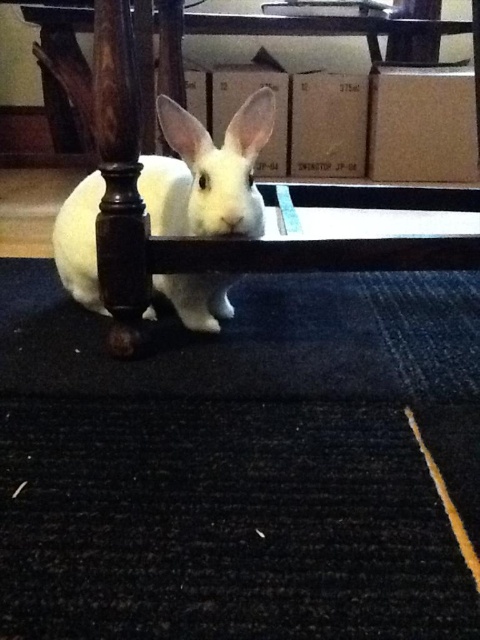
Question: Can you confirm if black textured mat at lower center is wider than white soft fur rabbit at center?

Choices:
 (A) no
 (B) yes

Answer: (B)

Question: Does black textured mat at lower center appear on the left side of white soft fur rabbit at center?

Choices:
 (A) no
 (B) yes

Answer: (A)

Question: Does black textured mat at lower center have a smaller size compared to white soft fur rabbit at center?

Choices:
 (A) yes
 (B) no

Answer: (B)

Question: Which object is farther from the camera taking this photo?

Choices:
 (A) black textured mat at lower center
 (B) white soft fur rabbit at center

Answer: (B)

Question: Which point is closer to the camera?

Choices:
 (A) black textured mat at lower center
 (B) white soft fur rabbit at center

Answer: (A)